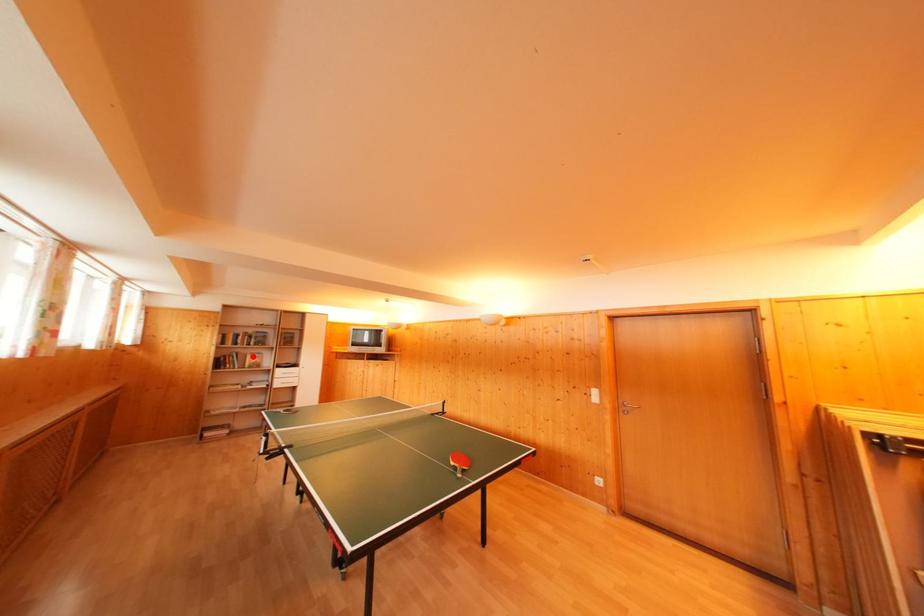
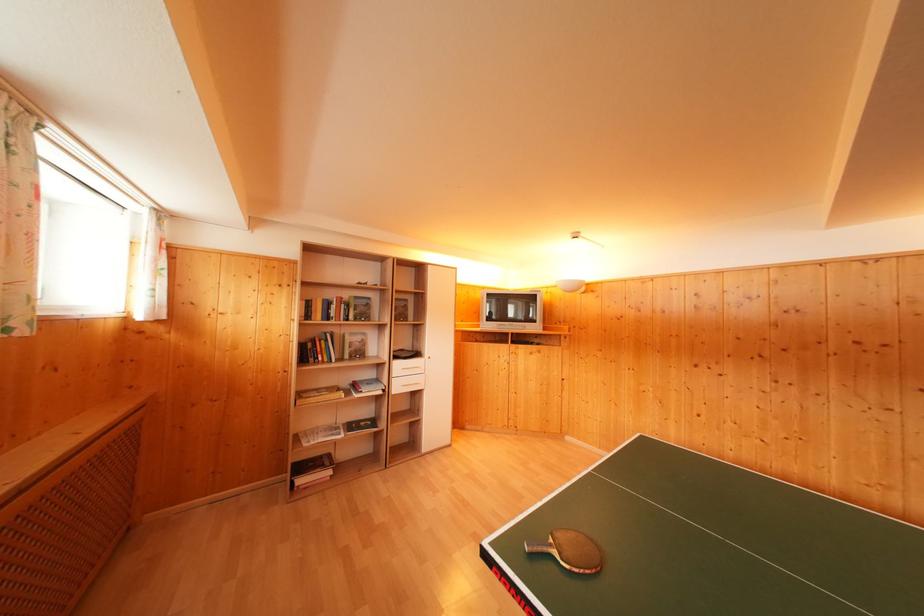
The point at the highlighted location is marked in the first image. Where is the corresponding point in the second image?

(350, 336)